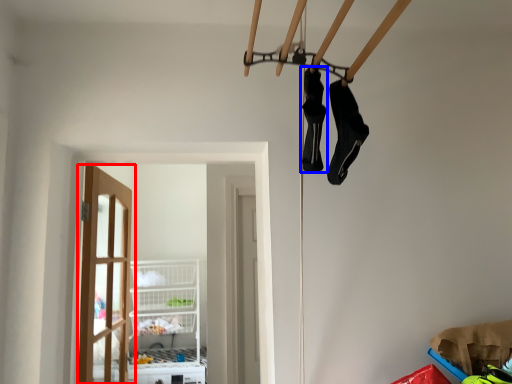
Question: Which point is closer to the camera, door (highlighted by a red box) or footwear (highlighted by a blue box)?

Choices:
 (A) door
 (B) footwear

Answer: (B)